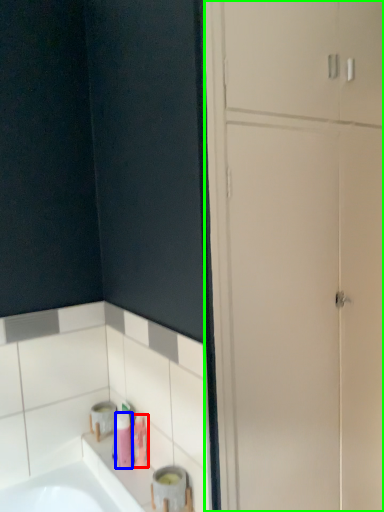
Question: Based on their relative distances, which object is farther from toiletry (highlighted by a red box)? Choose from toiletry (highlighted by a blue box) and dresser (highlighted by a green box).

Choices:
 (A) toiletry
 (B) dresser

Answer: (B)